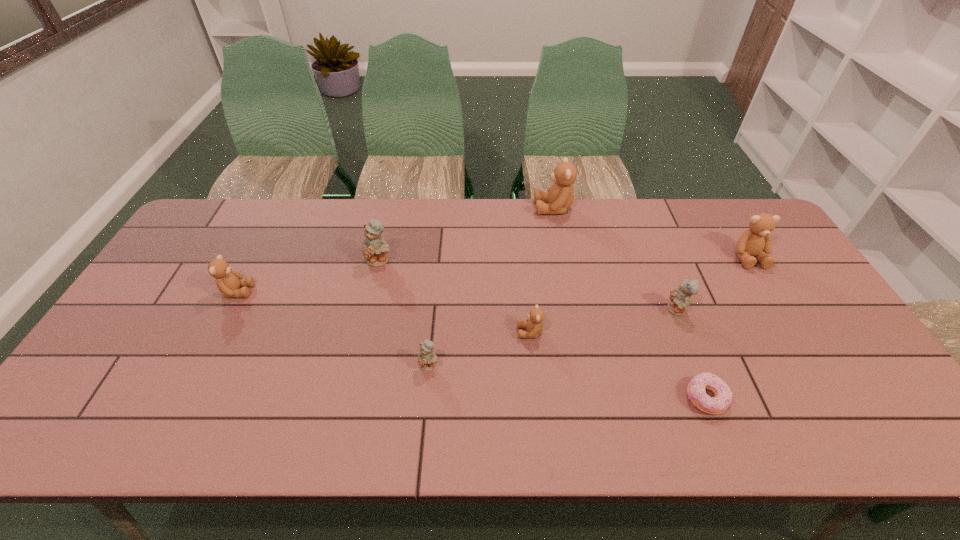
At what (x,y) coordinates should I click in order to perform the action: click on empty location between the second nearest teddy bear and the leftmost blue teddy bear. Please return your answer as a coordinate pair (x, y). The height and width of the screenshot is (540, 960). Looking at the image, I should click on (455, 296).

Where is `free area in between the sixth farthest object and the second teddy bear from left to right`? The height and width of the screenshot is (540, 960). free area in between the sixth farthest object and the second teddy bear from left to right is located at coordinates (455, 296).

You are a GUI agent. You are given a task and a screenshot of the screen. Output one action in this format:
    pyautogui.click(x=<x>, y=<y>)
    Task: Click on the vacant area between the second nearest brown teddy bear and the purple doughnut
    
    Given the screenshot: What is the action you would take?
    pyautogui.click(x=471, y=345)

Locate an element on the screen. The height and width of the screenshot is (540, 960). vacant space that is in between the second object from left to right and the second brown teddy bear from right to left is located at coordinates (467, 234).

Find the location of a particular element. This screenshot has width=960, height=540. free spot between the second smallest brown teddy bear and the nearest object is located at coordinates (471, 345).

What are the coordinates of `vacant region between the tallest object and the leftmost object` in the screenshot? It's located at (396, 250).

This screenshot has height=540, width=960. I want to click on free space between the sixth farthest object and the rightmost brown teddy bear, so click(x=639, y=295).

Find the location of a particular element. empty space that is in between the tallest object and the third smallest brown teddy bear is located at coordinates (651, 233).

This screenshot has height=540, width=960. I want to click on empty location between the sixth teddy bear from left to right and the leftmost brown teddy bear, so click(x=457, y=301).

The image size is (960, 540). Find the location of `the closest object to the doughnut`. the closest object to the doughnut is located at coordinates (680, 298).